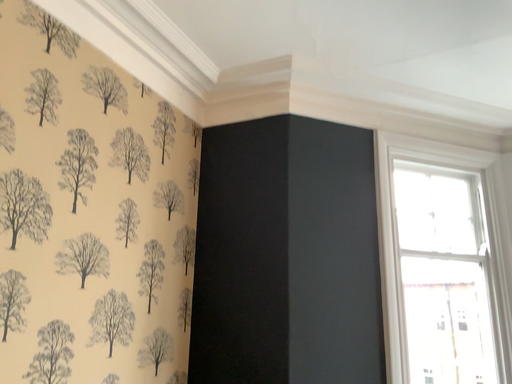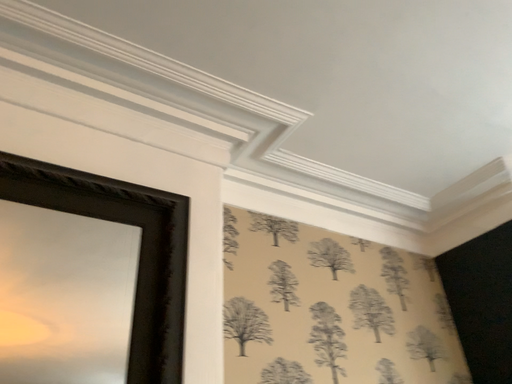
Question: How did the camera likely rotate when shooting the video?

Choices:
 (A) rotated right
 (B) rotated left

Answer: (B)